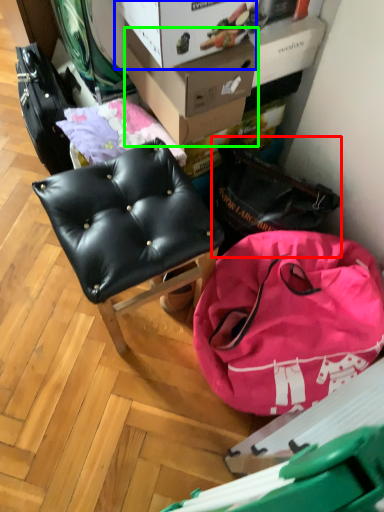
Question: Which object is positioned closest to messenger bag (highlighted by a red box)? Select from cardboard box (highlighted by a blue box) and cardboard box (highlighted by a green box).

Choices:
 (A) cardboard box
 (B) cardboard box

Answer: (B)